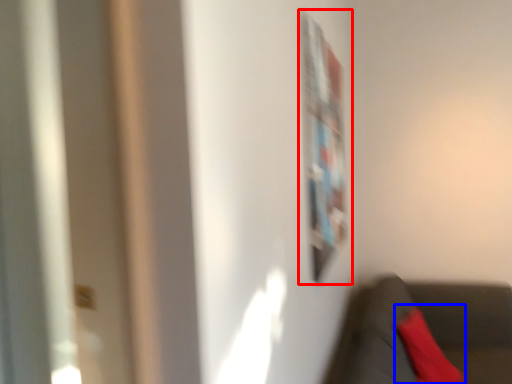
Question: Among these objects, which one is nearest to the camera, bulletin board (highlighted by a red box) or pillow (highlighted by a blue box)?

Choices:
 (A) bulletin board
 (B) pillow

Answer: (A)